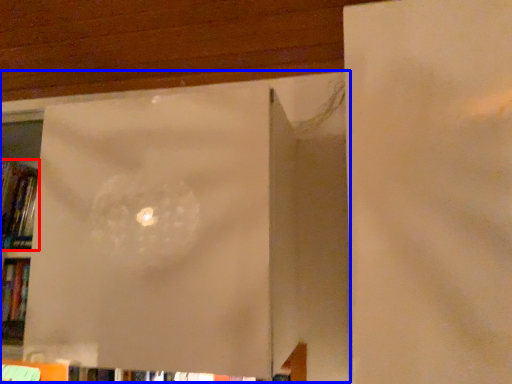
Question: Which point is further to the camera, book (highlighted by a red box) or window frame (highlighted by a blue box)?

Choices:
 (A) book
 (B) window frame

Answer: (A)